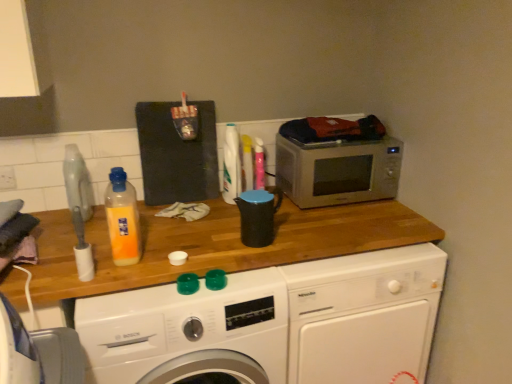
This screenshot has height=384, width=512. What do you see at coordinates (258, 216) in the screenshot?
I see `black plastic kettle at center` at bounding box center [258, 216].

I want to click on translucent plastic bottle at center, so click(x=122, y=219).

How much space does white glossy washing machine at center, the first washing machine positioned from the left, occupy vertically?

33.16 inches.

Find the location of a particular element. This screenshot has width=512, height=384. black plastic kettle at center is located at coordinates (258, 216).

Choose the correct answer: Is white plastic power plugs and sockets at upper left inside translucent plastic bottle at center or outside it?

white plastic power plugs and sockets at upper left is spatially situated outside translucent plastic bottle at center.

Based on the photo, which object is closer to the camera taking this photo, white plastic power plugs and sockets at upper left or translucent plastic bottle at center?

translucent plastic bottle at center is closer to the camera.

Considering the points (13, 177) and (112, 214), which point is behind, point (13, 177) or point (112, 214)?

The point (13, 177) is more distant.

From a real-world perspective, who is located lower, white plastic power plugs and sockets at upper left or translucent plastic bottle at center?

In real-world perspective, white plastic power plugs and sockets at upper left is lower.

Could you measure the distance between black plastic kettle at center and white plastic power plugs and sockets at upper left?

black plastic kettle at center and white plastic power plugs and sockets at upper left are 37.97 inches apart from each other.

Which point is more forward, (245, 207) or (13, 185)?

The point (245, 207) is closer to the camera.

Is black plastic kettle at center far from white plastic power plugs and sockets at upper left?

black plastic kettle at center is near white plastic power plugs and sockets at upper left, not far away.

Identify the location of appliance located in front of the white plastic power plugs and sockets at upper left. (258, 216).

Is white glossy washing machine at center, the 2th washing machine in the right-to-left sequence, turned away from white plastic power plugs and sockets at upper left?

No, white plastic power plugs and sockets at upper left is not at the back of white glossy washing machine at center, the 2th washing machine in the right-to-left sequence.

Between point (165, 345) and point (4, 169), which one is positioned in front?

Point (165, 345)

Considering the relative sizes of white glossy washing machine at center, the 2th washing machine in the right-to-left sequence, and white plastic power plugs and sockets at upper left in the image provided, is white glossy washing machine at center, the 2th washing machine in the right-to-left sequence, wider than white plastic power plugs and sockets at upper left?

Yes.

Between white glossy washing machine at center, the first washing machine positioned from the left, and white plastic power plugs and sockets at upper left, which one has smaller size?

white plastic power plugs and sockets at upper left is smaller.

Can you tell me how much translucent plastic bottle at center and satin silver microwave at upper right differ in facing direction?

They differ by 0.505 degrees in their facing directions.

From the picture: Is satin silver microwave at upper right located within translucent plastic bottle at center?

No, satin silver microwave at upper right is located outside of translucent plastic bottle at center.

Would you say translucent plastic bottle at center is to the left or to the right of satin silver microwave at upper right in the picture?

In the image, translucent plastic bottle at center appears on the left side of satin silver microwave at upper right.

Based on the photo, is translucent plastic bottle at center oriented towards satin silver microwave at upper right?

No, translucent plastic bottle at center does not turn towards satin silver microwave at upper right.

From a real-world perspective, who is located lower, white plastic power plugs and sockets at upper left or satin silver microwave at upper right?

From a 3D spatial view, satin silver microwave at upper right is below.

Could you tell me if white plastic power plugs and sockets at upper left is facing satin silver microwave at upper right?

No, white plastic power plugs and sockets at upper left is not facing towards satin silver microwave at upper right.

From the image's perspective, which one is positioned higher, white plastic power plugs and sockets at upper left or satin silver microwave at upper right?

satin silver microwave at upper right appears higher in the image.

Which of these two, white glossy washing machine at center, the first washing machine positioned from the left, or white glossy washing machine at center, positioned as the first washing machine in right-to-left order, is thinner?

Thinner between the two is white glossy washing machine at center, positioned as the first washing machine in right-to-left order.

Between white glossy washing machine at center, the first washing machine positioned from the left, and white glossy washing machine at center, the second washing machine viewed from the left, which one appears on the right side from the viewer's perspective?

Positioned to the right is white glossy washing machine at center, the second washing machine viewed from the left.

From the image's perspective, is white glossy washing machine at center, the first washing machine positioned from the left, located above white glossy washing machine at center, the second washing machine viewed from the left?

Incorrect, from the image's perspective, white glossy washing machine at center, the first washing machine positioned from the left, is lower than white glossy washing machine at center, the second washing machine viewed from the left.

Which object is further away from the camera, white glossy washing machine at center, the first washing machine positioned from the left, or white glossy washing machine at center, positioned as the first washing machine in right-to-left order?

white glossy washing machine at center, positioned as the first washing machine in right-to-left order, is further away from the camera.

Does translucent plastic bottle at center have a lesser width compared to white glossy washing machine at center, the 2th washing machine in the right-to-left sequence?

Yes, translucent plastic bottle at center is thinner than white glossy washing machine at center, the 2th washing machine in the right-to-left sequence.

Is translucent plastic bottle at center facing towards white glossy washing machine at center, the first washing machine positioned from the left?

No, translucent plastic bottle at center does not turn towards white glossy washing machine at center, the first washing machine positioned from the left.

From a real-world perspective, count 1st washing machines downward from the translucent plastic bottle at center and point to it. Please provide its 2D coordinates.

[(189, 331)]

From the image's perspective, which is above, translucent plastic bottle at center or white glossy washing machine at center, the 2th washing machine in the right-to-left sequence?

From the image's view, translucent plastic bottle at center is above.

Image resolution: width=512 pixels, height=384 pixels. Find the location of `bottle below the white plastic power plugs and sockets at upper left (from the image's perspective)`. bottle below the white plastic power plugs and sockets at upper left (from the image's perspective) is located at coordinates (122, 219).

The image size is (512, 384). What are the coordinates of `appliance that appears on the right of white plastic power plugs and sockets at upper left` in the screenshot? It's located at (258, 216).

Considering their positions, is white glossy washing machine at center, positioned as the first washing machine in right-to-left order, positioned further to satin silver microwave at upper right than white plastic power plugs and sockets at upper left?

white plastic power plugs and sockets at upper left is positioned further to the anchor satin silver microwave at upper right.

Based on their spatial positions, is black plastic kettle at center or white plastic power plugs and sockets at upper left further from white glossy washing machine at center, the second washing machine viewed from the left?

white plastic power plugs and sockets at upper left is further to white glossy washing machine at center, the second washing machine viewed from the left.

When comparing their distances from black plastic kettle at center, does white glossy washing machine at center, the second washing machine viewed from the left, or white glossy washing machine at center, the first washing machine positioned from the left, seem further?

white glossy washing machine at center, the second washing machine viewed from the left, is further to black plastic kettle at center.

Considering their positions, is white glossy washing machine at center, the first washing machine positioned from the left, positioned further to white glossy washing machine at center, the second washing machine viewed from the left, than black plastic kettle at center?

black plastic kettle at center is positioned further to the anchor white glossy washing machine at center, the second washing machine viewed from the left.

Estimate the real-world distances between objects in this image. Which object is further from white glossy washing machine at center, the first washing machine positioned from the left, satin silver microwave at upper right or translucent plastic bottle at center?

Based on the image, satin silver microwave at upper right appears to be further to white glossy washing machine at center, the first washing machine positioned from the left.

Considering their positions, is satin silver microwave at upper right positioned further to translucent plastic bottle at center than white plastic power plugs and sockets at upper left?

The object further to translucent plastic bottle at center is satin silver microwave at upper right.

Which object lies further to the anchor point white plastic power plugs and sockets at upper left, white glossy washing machine at center, the 2th washing machine in the right-to-left sequence, or translucent plastic bottle at center?

Based on the image, white glossy washing machine at center, the 2th washing machine in the right-to-left sequence, appears to be further to white plastic power plugs and sockets at upper left.

Estimate the real-world distances between objects in this image. Which object is further from white glossy washing machine at center, the 2th washing machine in the right-to-left sequence, white plastic power plugs and sockets at upper left or black plastic kettle at center?

The object further to white glossy washing machine at center, the 2th washing machine in the right-to-left sequence, is white plastic power plugs and sockets at upper left.

This screenshot has width=512, height=384. In order to click on washing machine between white plastic power plugs and sockets at upper left and white glossy washing machine at center, the second washing machine viewed from the left, in the horizontal direction in this screenshot , I will do `click(189, 331)`.

This screenshot has width=512, height=384. I want to click on appliance between translucent plastic bottle at center and white glossy washing machine at center, the 2th washing machine in the right-to-left sequence, in the up-down direction, so click(258, 216).

What are the coordinates of `washing machine located between white plastic power plugs and sockets at upper left and black plastic kettle at center in the left-right direction` in the screenshot? It's located at (189, 331).

Where is `appliance situated between white plastic power plugs and sockets at upper left and satin silver microwave at upper right from left to right`? Image resolution: width=512 pixels, height=384 pixels. appliance situated between white plastic power plugs and sockets at upper left and satin silver microwave at upper right from left to right is located at coordinates (258, 216).